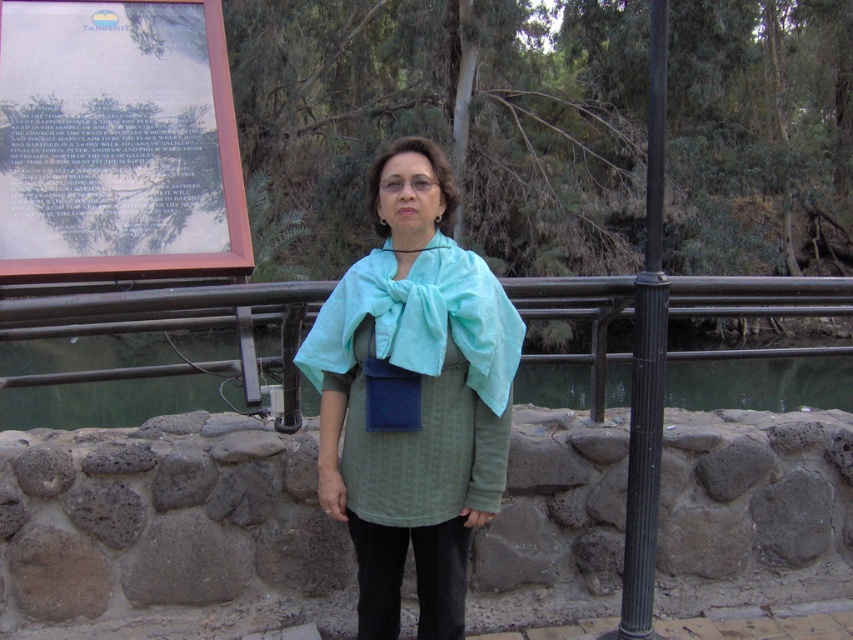
What do you see at coordinates (413, 396) in the screenshot? I see `teal fabric shawl at center` at bounding box center [413, 396].

Is teal fabric shawl at center to the left of black metal pole at right from the viewer's perspective?

Yes, teal fabric shawl at center is to the left of black metal pole at right.

Locate an element on the screen. This screenshot has height=640, width=853. teal fabric shawl at center is located at coordinates (413, 396).

Is wooden signboard at upper left to the left of metal/textured rail at center from the viewer's perspective?

Indeed, wooden signboard at upper left is positioned on the left side of metal/textured rail at center.

Does wooden signboard at upper left lie behind metal/textured rail at center?

That is True.

Which is in front, point (77, 28) or point (71, 328)?

Positioned in front is point (71, 328).

Find the location of a particular element. The width and height of the screenshot is (853, 640). wooden signboard at upper left is located at coordinates (115, 140).

Is teal fabric shawl at center positioned behind metal/textured rail at center?

No, teal fabric shawl at center is in front of metal/textured rail at center.

Does teal fabric shawl at center have a larger size compared to metal/textured rail at center?

No.

Where is `teal fabric shawl at center`? Image resolution: width=853 pixels, height=640 pixels. teal fabric shawl at center is located at coordinates (413, 396).